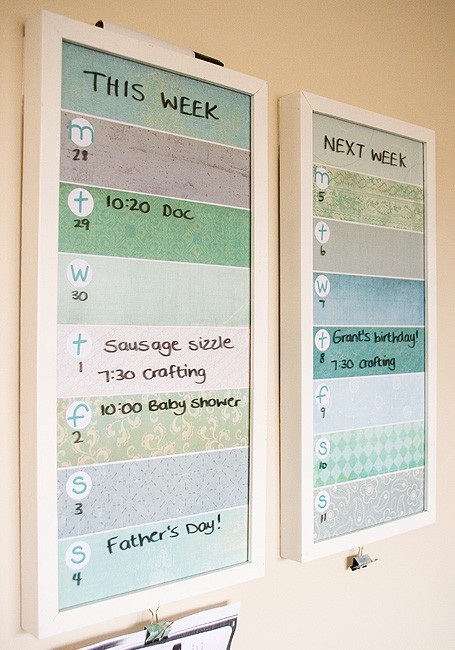
Image resolution: width=455 pixels, height=650 pixels. Find the location of `beige wall`. beige wall is located at coordinates tap(410, 625).